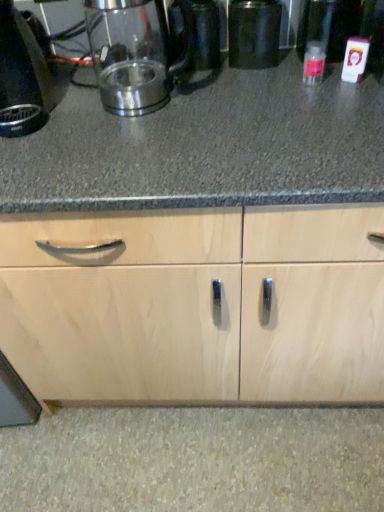
You are a GUI agent. You are given a task and a screenshot of the screen. Output one action in this format:
    pyautogui.click(x=<x>, y=<y>)
    Task: Click on the black plastic kettle at left
    Image resolution: width=384 pixels, height=512 pixels.
    Given the screenshot: What is the action you would take?
    [x=21, y=76]

Identify the location of clear plastic bottle at right. (314, 62).

Where is `satin metallic kettle at upper left`? satin metallic kettle at upper left is located at coordinates (135, 53).

Which is correct: clear plastic bottle at right is inside metallic black canister at center, or outside of it?

clear plastic bottle at right is outside metallic black canister at center.

Consider the image. Measure the distance from clear plastic bottle at right to metallic black canister at center.

clear plastic bottle at right is 5.15 inches away from metallic black canister at center.

Could you tell me if clear plastic bottle at right is facing metallic black canister at center?

No, clear plastic bottle at right does not turn towards metallic black canister at center.

Is there a large distance between metallic black canister at center and black plastic kettle at left?

Actually, metallic black canister at center and black plastic kettle at left are a little close together.

I want to click on appliance beneath the black plastic kettle at left (from a real-world perspective), so click(x=254, y=33).

From the image's perspective, is metallic black canister at center located beneath black plastic kettle at left?

No, from the image's perspective, metallic black canister at center is not below black plastic kettle at left.

From a real-world perspective, relative to clear plastic bottle at right, is satin metallic kettle at upper left vertically above or below?

satin metallic kettle at upper left is situated higher than clear plastic bottle at right in the real world.

Is the depth of satin metallic kettle at upper left greater than that of clear plastic bottle at right?

No, satin metallic kettle at upper left is in front of clear plastic bottle at right.

Considering the positions of point (129, 63) and point (321, 65), is point (129, 63) closer or farther from the camera than point (321, 65)?

Point (129, 63) is farther from the camera than point (321, 65).

How many degrees apart are the facing directions of satin metallic kettle at upper left and clear plastic bottle at right?

They differ by 0.00255 degrees in their facing directions.

Considering the relative sizes of clear plastic bottle at right and black plastic kettle at left in the image provided, is clear plastic bottle at right taller than black plastic kettle at left?

Incorrect, the height of clear plastic bottle at right is not larger of that of black plastic kettle at left.

Is clear plastic bottle at right aimed at black plastic kettle at left?

No.

In the scene shown: Which object is positioned more to the right, clear plastic bottle at right or black plastic kettle at left?

Positioned to the right is clear plastic bottle at right.

Which is more to the right, black plastic kettle at left or metallic black canister at center?

metallic black canister at center is more to the right.

Is black plastic kettle at left bigger or smaller than metallic black canister at center?

Considering their sizes, black plastic kettle at left takes up more space than metallic black canister at center.

Does point (32, 46) lie in front of point (229, 37)?

Yes, point (32, 46) is in front of point (229, 37).

Is metallic black canister at center taller or shorter than clear plastic bottle at right?

Clearly, metallic black canister at center is taller compared to clear plastic bottle at right.

Is metallic black canister at center aimed at clear plastic bottle at right?

No, metallic black canister at center does not turn towards clear plastic bottle at right.

Between metallic black canister at center and clear plastic bottle at right, which one appears on the right side from the viewer's perspective?

clear plastic bottle at right.

Does metallic black canister at center have a smaller size compared to clear plastic bottle at right?

Actually, metallic black canister at center might be larger than clear plastic bottle at right.

From the image's perspective, which one is positioned higher, clear plastic bottle at right or satin metallic kettle at upper left?

satin metallic kettle at upper left, from the image's perspective.

Considering the sizes of objects clear plastic bottle at right and satin metallic kettle at upper left in the image provided, who is thinner, clear plastic bottle at right or satin metallic kettle at upper left?

With smaller width is clear plastic bottle at right.

In the scene shown: Considering the sizes of objects clear plastic bottle at right and satin metallic kettle at upper left in the image provided, who is taller, clear plastic bottle at right or satin metallic kettle at upper left?

With more height is satin metallic kettle at upper left.

Is clear plastic bottle at right not near satin metallic kettle at upper left?

No, clear plastic bottle at right is not far from satin metallic kettle at upper left.

Where is `appliance that is above the clear plastic bottle at right (from a real-world perspective)`? The width and height of the screenshot is (384, 512). appliance that is above the clear plastic bottle at right (from a real-world perspective) is located at coordinates (254, 33).

Where is `appliance above the black plastic kettle at left (from the image's perspective)`? The image size is (384, 512). appliance above the black plastic kettle at left (from the image's perspective) is located at coordinates (254, 33).

Considering their positions, is satin metallic kettle at upper left positioned further to clear plastic bottle at right than metallic black canister at center?

satin metallic kettle at upper left is further to clear plastic bottle at right.

Which object lies nearer to the anchor point satin metallic kettle at upper left, metallic black canister at center or clear plastic bottle at right?

Based on the image, metallic black canister at center appears to be nearer to satin metallic kettle at upper left.

Estimate the real-world distances between objects in this image. Which object is further from satin metallic kettle at upper left, clear plastic bottle at right or black plastic kettle at left?

The object further to satin metallic kettle at upper left is clear plastic bottle at right.

From the image, which object appears to be farther from clear plastic bottle at right, black plastic kettle at left or satin metallic kettle at upper left?

Based on the image, black plastic kettle at left appears to be further to clear plastic bottle at right.

Considering their positions, is clear plastic bottle at right positioned closer to black plastic kettle at left than metallic black canister at center?

metallic black canister at center lies closer to black plastic kettle at left than the other object.

From the image, which object appears to be farther from black plastic kettle at left, clear plastic bottle at right or satin metallic kettle at upper left?

clear plastic bottle at right is further to black plastic kettle at left.

When comparing their distances from black plastic kettle at left, does metallic black canister at center or satin metallic kettle at upper left seem further?

The object further to black plastic kettle at left is metallic black canister at center.

From the image, which object appears to be nearer to clear plastic bottle at right, metallic black canister at center or black plastic kettle at left?

metallic black canister at center is positioned closer to the anchor clear plastic bottle at right.

In order to click on kitchen appliance located between black plastic kettle at left and metallic black canister at center in the left-right direction in this screenshot , I will do `click(135, 53)`.

Identify the location of appliance situated between black plastic kettle at left and clear plastic bottle at right from left to right. The height and width of the screenshot is (512, 384). (254, 33).

I want to click on appliance located between satin metallic kettle at upper left and clear plastic bottle at right in the left-right direction, so click(254, 33).

This screenshot has height=512, width=384. I want to click on kitchen appliance between black plastic kettle at left and clear plastic bottle at right in the horizontal direction, so click(135, 53).